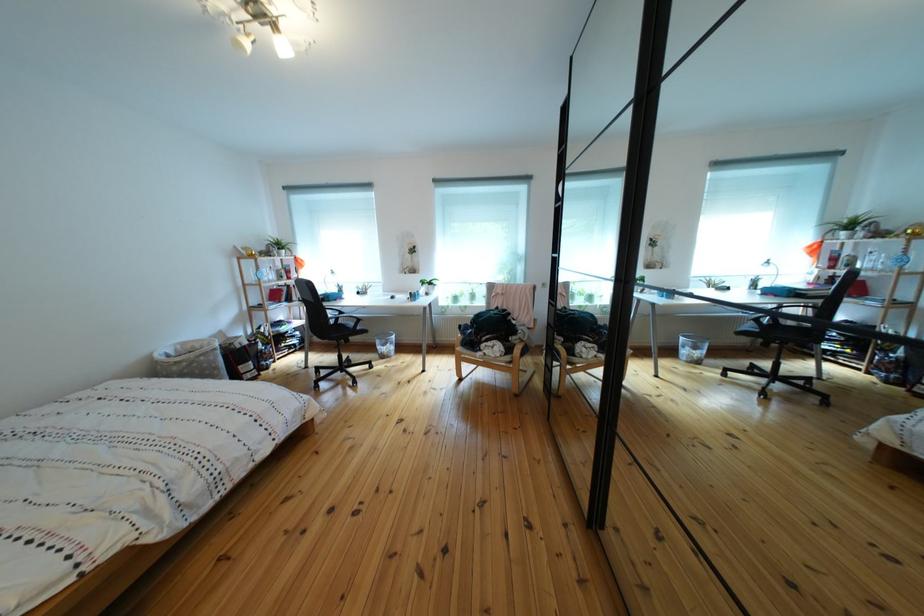
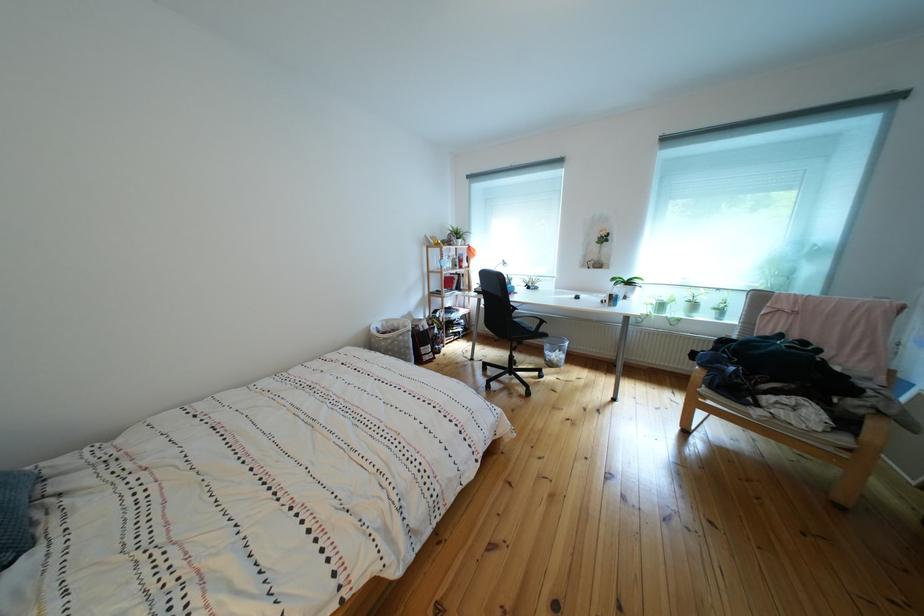
Question: Based on the continuous images, in which direction is the camera rotating? Reply with the corresponding letter.

Choices:
 (A) Left
 (B) Right
 (C) Up
 (D) Down

Answer: (A)